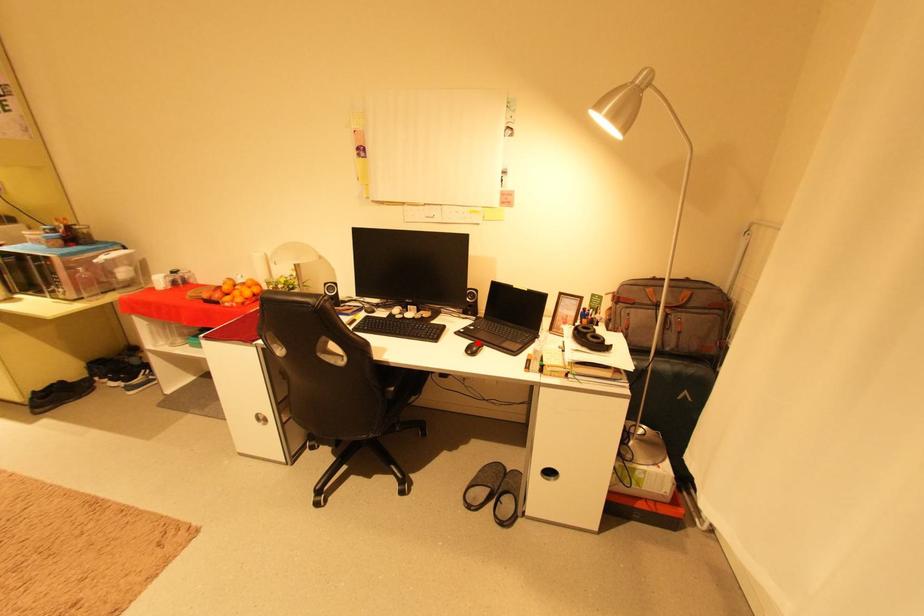
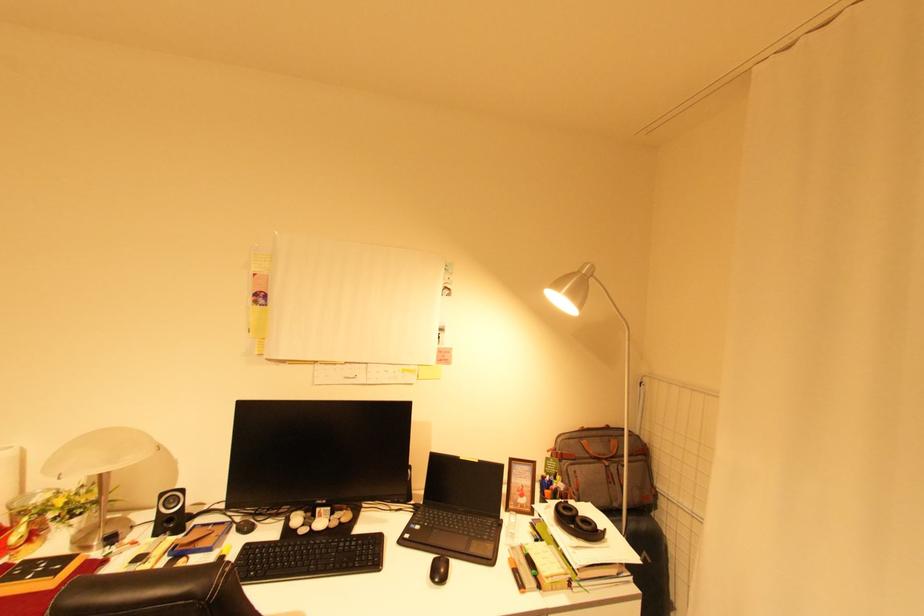
The point at the highlighted location is marked in the first image. Where is the corresponding point in the second image?

(441, 559)